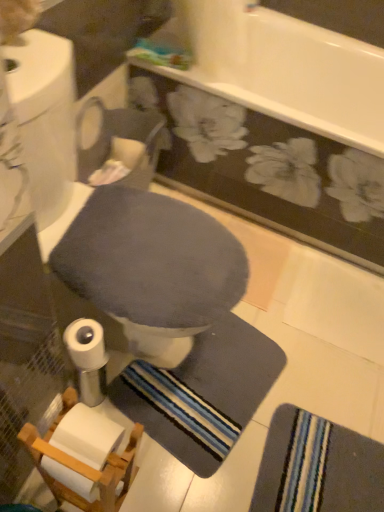
Question: Is dark gray fabric toilet bowl at center to the left or to the right of striped fabric bath towel at lower right in the image?

Choices:
 (A) left
 (B) right

Answer: (A)

Question: Is dark gray fabric toilet bowl at center situated inside striped fabric bath towel at lower right or outside?

Choices:
 (A) inside
 (B) outside

Answer: (B)

Question: From a real-world perspective, is dark gray fabric toilet bowl at center positioned above or below striped fabric bath towel at lower right?

Choices:
 (A) below
 (B) above

Answer: (B)

Question: In terms of height, does striped fabric bath towel at lower right look taller or shorter compared to dark gray fabric toilet bowl at center?

Choices:
 (A) tall
 (B) short

Answer: (B)

Question: Is striped fabric bath towel at lower right bigger or smaller than dark gray fabric toilet bowl at center?

Choices:
 (A) small
 (B) big

Answer: (A)

Question: From a real-world perspective, is striped fabric bath towel at lower right physically located above or below dark gray fabric toilet bowl at center?

Choices:
 (A) above
 (B) below

Answer: (B)

Question: From the image's perspective, relative to dark gray fabric toilet bowl at center, is striped fabric bath towel at lower right above or below?

Choices:
 (A) below
 (B) above

Answer: (A)